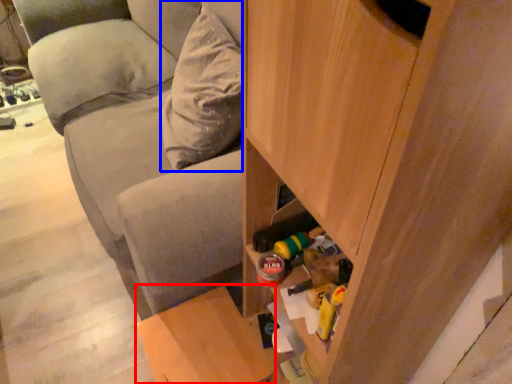
Question: Which object is further to the camera taking this photo, furniture (highlighted by a red box) or pillow (highlighted by a blue box)?

Choices:
 (A) furniture
 (B) pillow

Answer: (B)